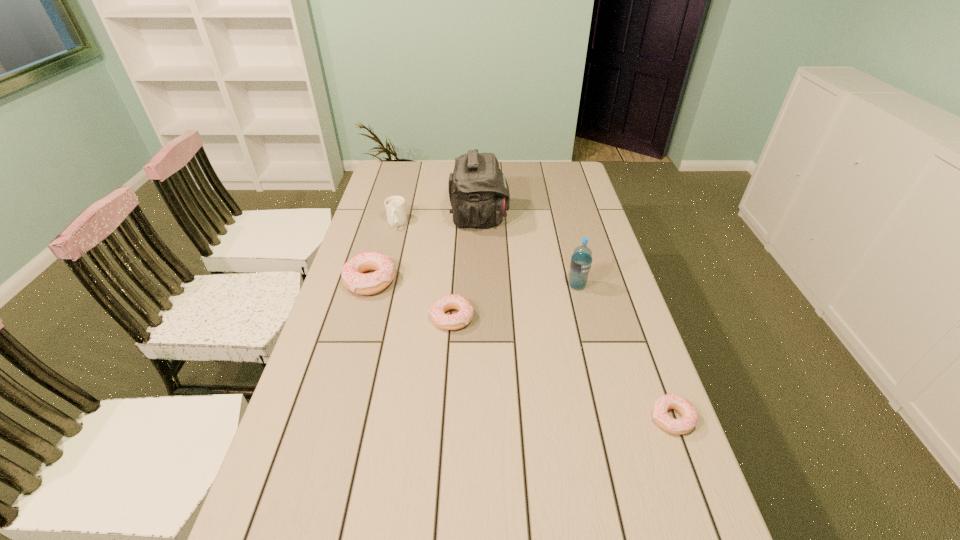
Where is `empty space between the cappuccino and the water bottle`? Image resolution: width=960 pixels, height=540 pixels. empty space between the cappuccino and the water bottle is located at coordinates (487, 254).

Where is `vacant area that lies between the cappuccino and the second object from right to left`? The height and width of the screenshot is (540, 960). vacant area that lies between the cappuccino and the second object from right to left is located at coordinates (487, 254).

In order to click on free space between the second doughnut from right to left and the shoulder bag in this screenshot , I will do `click(466, 268)`.

You are a GUI agent. You are given a task and a screenshot of the screen. Output one action in this format:
    pyautogui.click(x=<x>, y=<y>)
    Task: Click on the empty space that is in between the farthest doughnut and the tallest object
    This screenshot has width=960, height=540.
    Given the screenshot: What is the action you would take?
    pyautogui.click(x=425, y=249)

In order to click on object that ranks as the second closest to the shoulder bag in this screenshot , I will do `click(353, 278)`.

At what (x,y) coordinates should I click in order to perform the action: click on object identified as the second closest to the leftmost doughnut. Please return your answer as a coordinate pair (x, y). This screenshot has height=540, width=960. Looking at the image, I should click on (395, 207).

At what (x,y) coordinates should I click in order to perform the action: click on the third closest doughnut relative to the shoulder bag. Please return your answer as a coordinate pair (x, y). The height and width of the screenshot is (540, 960). Looking at the image, I should click on (689, 420).

Locate which doughnut ranks in proximity to the rightmost object. Please provide its 2D coordinates. Your answer should be formatted as a tuple, i.e. [(x, y)], where the tuple contains the x and y coordinates of a point satisfying the conditions above.

[(462, 318)]

Locate an element on the screen. blank space that satisfies the following two spatial constraints: 1. on the open flap of the fifth shortest object; 2. on the right side of the tallest object is located at coordinates (479, 286).

I want to click on vacant space that satisfies the following two spatial constraints: 1. on the open flap of the tallest object; 2. on the right side of the second object from right to left, so click(479, 286).